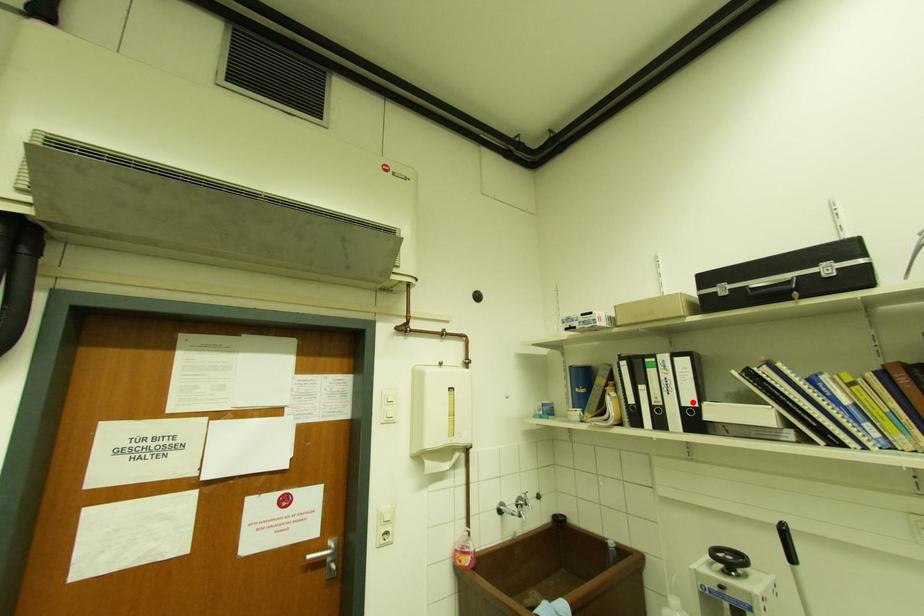
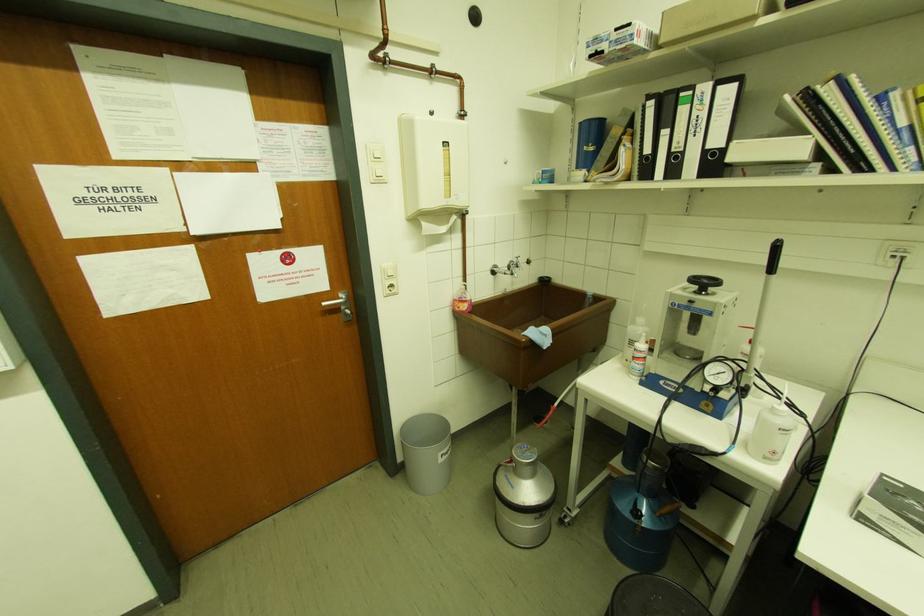
The point at the highlighted location is marked in the first image. Where is the corresponding point in the second image?

(720, 143)